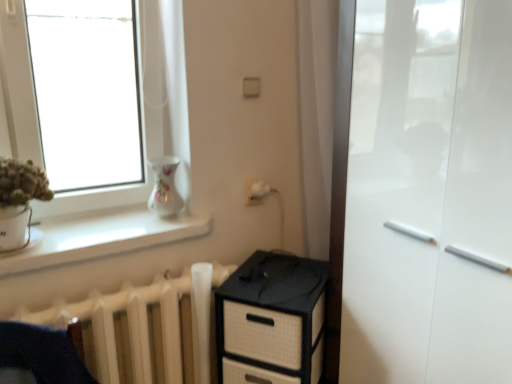
You are a GUI agent. You are given a task and a screenshot of the screen. Output one action in this format:
    pyautogui.click(x=<x>, y=<y>)
    Task: Click on the vacant space to the left of porcelain floral vase at upper left
    The width and height of the screenshot is (512, 384).
    Given the screenshot: What is the action you would take?
    pyautogui.click(x=118, y=223)